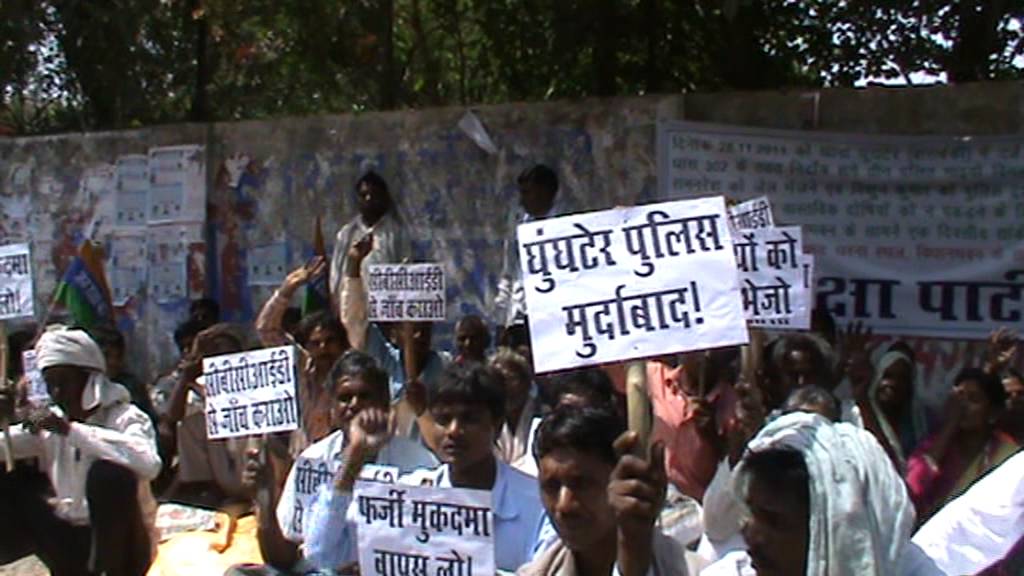
Where is `wall`? This screenshot has height=576, width=1024. wall is located at coordinates (95, 151), (297, 147), (902, 118).